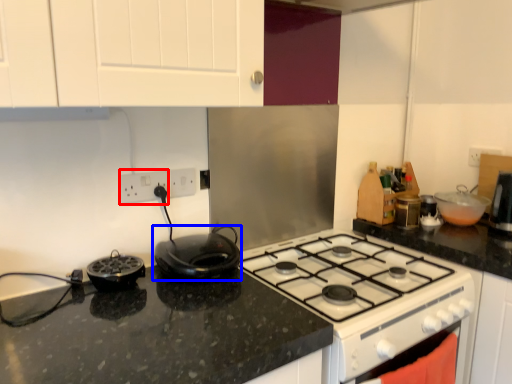
Question: Which object is closer to the camera taking this photo, electric outlet (highlighted by a red box) or kitchen appliance (highlighted by a blue box)?

Choices:
 (A) electric outlet
 (B) kitchen appliance

Answer: (B)